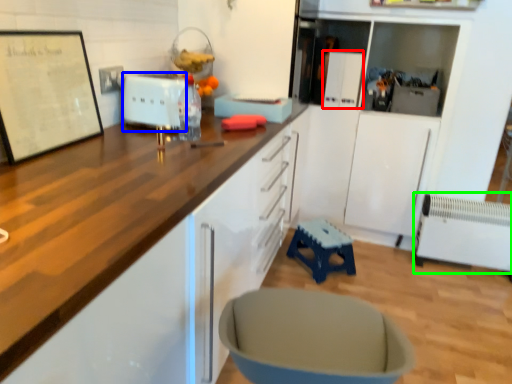
Question: Which is nearer to the appliance (highlighted by a red box)? appliance (highlighted by a blue box) or radiator (highlighted by a green box).

Choices:
 (A) appliance
 (B) radiator

Answer: (B)